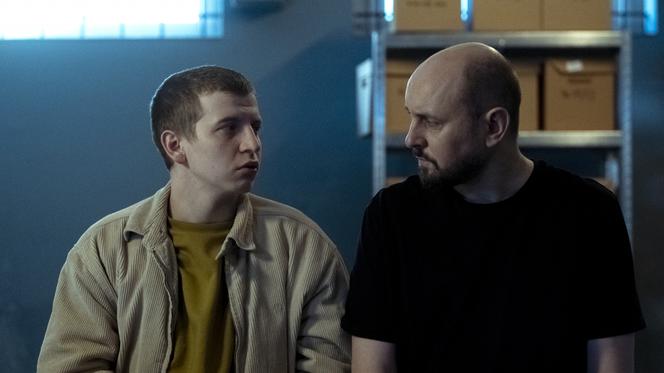
Where is `shelving`? shelving is located at coordinates (380, 38).